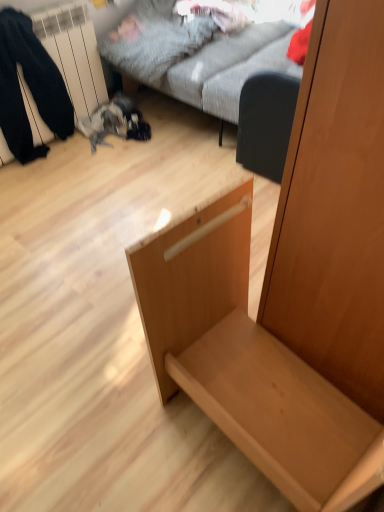
Question: Should I look upward or downward to see black matte swivel chair at center-right?

Choices:
 (A) down
 (B) up

Answer: (B)

Question: Does textured gray fabric couch at upper center have a lesser width compared to light wood drawer at center?

Choices:
 (A) yes
 (B) no

Answer: (B)

Question: Is textured gray fabric couch at upper center aimed at light wood drawer at center?

Choices:
 (A) no
 (B) yes

Answer: (A)

Question: Is textured gray fabric couch at upper center placed right next to light wood drawer at center?

Choices:
 (A) no
 (B) yes

Answer: (A)

Question: Is textured gray fabric couch at upper center smaller than light wood drawer at center?

Choices:
 (A) no
 (B) yes

Answer: (A)

Question: Does textured gray fabric couch at upper center appear on the left side of light wood drawer at center?

Choices:
 (A) yes
 (B) no

Answer: (B)

Question: Is light wood drawer at center a part of textured gray fabric couch at upper center?

Choices:
 (A) yes
 (B) no

Answer: (B)

Question: Is black matte swivel chair at center-right not within light wood drawer at center?

Choices:
 (A) yes
 (B) no

Answer: (A)

Question: Are black matte swivel chair at center-right and light wood drawer at center far apart?

Choices:
 (A) yes
 (B) no

Answer: (B)

Question: Does black matte swivel chair at center-right have a greater width compared to light wood drawer at center?

Choices:
 (A) yes
 (B) no

Answer: (B)

Question: Considering the relative sizes of black matte swivel chair at center-right and light wood drawer at center in the image provided, is black matte swivel chair at center-right bigger than light wood drawer at center?

Choices:
 (A) yes
 (B) no

Answer: (B)

Question: From a real-world perspective, is black matte swivel chair at center-right positioned under light wood drawer at center based on gravity?

Choices:
 (A) yes
 (B) no

Answer: (A)

Question: Is the position of black matte swivel chair at center-right more distant than that of light wood drawer at center?

Choices:
 (A) yes
 (B) no

Answer: (A)

Question: Is textured gray fabric couch at upper center next to black matte swivel chair at center-right?

Choices:
 (A) no
 (B) yes

Answer: (A)